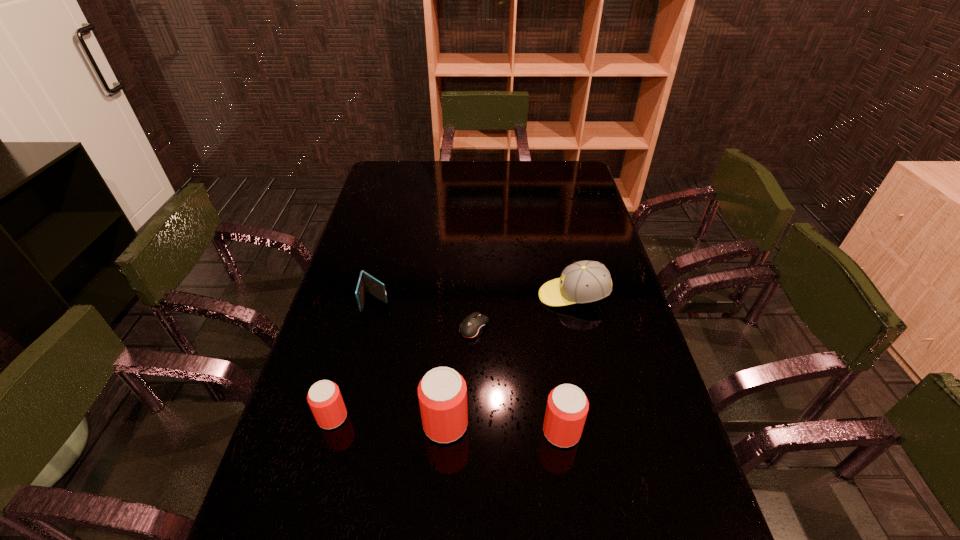
Given the evenly spaced beer cans in the image, where should an extra beer can be added on the right to preserve the spacing? Please point to a vacant space. Please provide its 2D coordinates. Your answer should be formatted as a tuple, i.e. [(x, y)], where the tuple contains the x and y coordinates of a point satisfying the conditions above.

[(681, 438)]